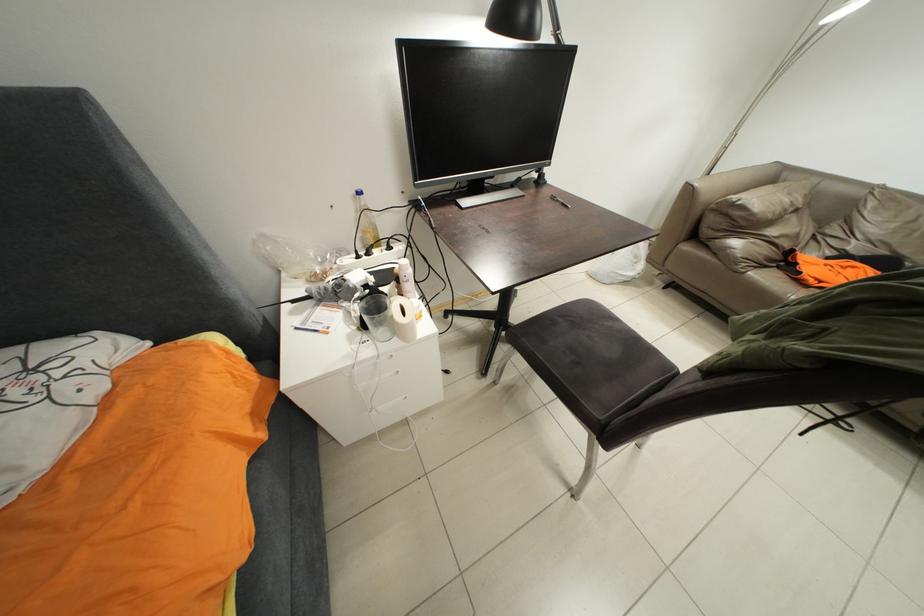
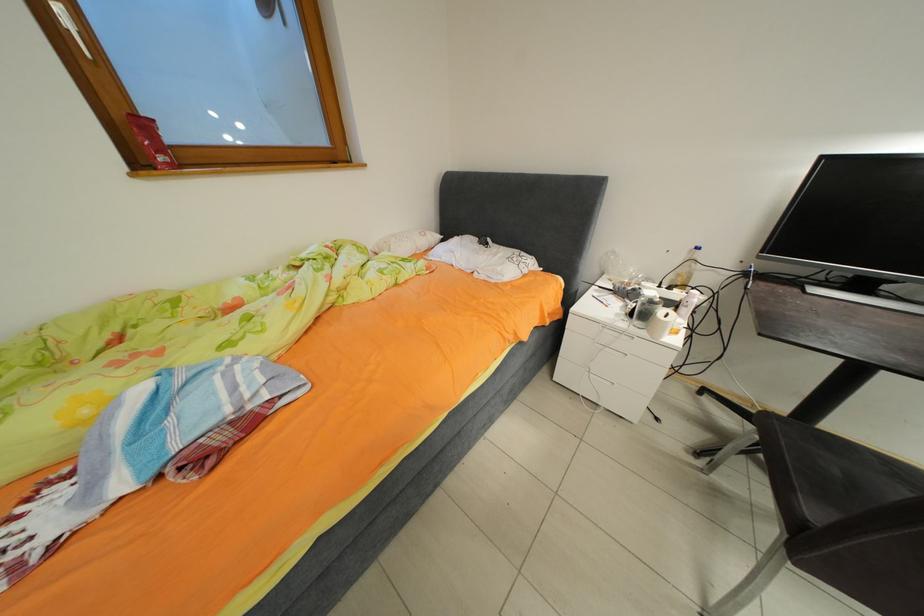
Question: The first image is from the beginning of the video and the second image is from the end. How did the camera likely rotate when shooting the video?

Choices:
 (A) Left
 (B) Right
 (C) Up
 (D) Down

Answer: (A)